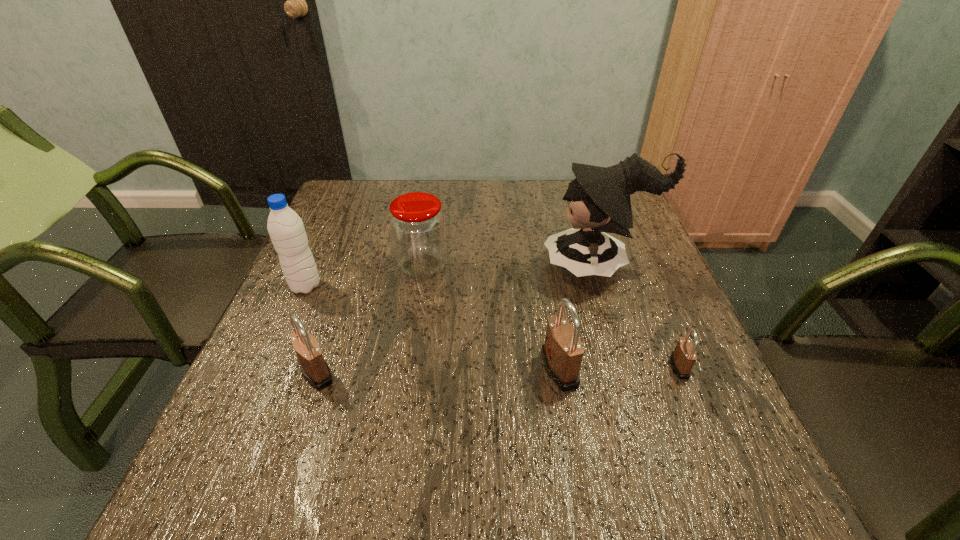
In order to click on vacant region that satisfies the following two spatial constraints: 1. on the back side of the second object from left to right; 2. on the right side of the jar in this screenshot , I will do `click(352, 265)`.

This screenshot has width=960, height=540. In order to click on vacant space that satisfies the following two spatial constraints: 1. on the back side of the second padlock from left to right; 2. on the right side of the leftmost padlock in this screenshot , I will do `click(318, 369)`.

Identify the location of vacant area that satisfies the following two spatial constraints: 1. at the face of the tallest object; 2. on the front side of the second shortest object. (634, 373).

Find the location of `free location that satisfies the following two spatial constraints: 1. on the front side of the leftmost object; 2. on the left side of the second shortest padlock`. free location that satisfies the following two spatial constraints: 1. on the front side of the leftmost object; 2. on the left side of the second shortest padlock is located at coordinates (267, 373).